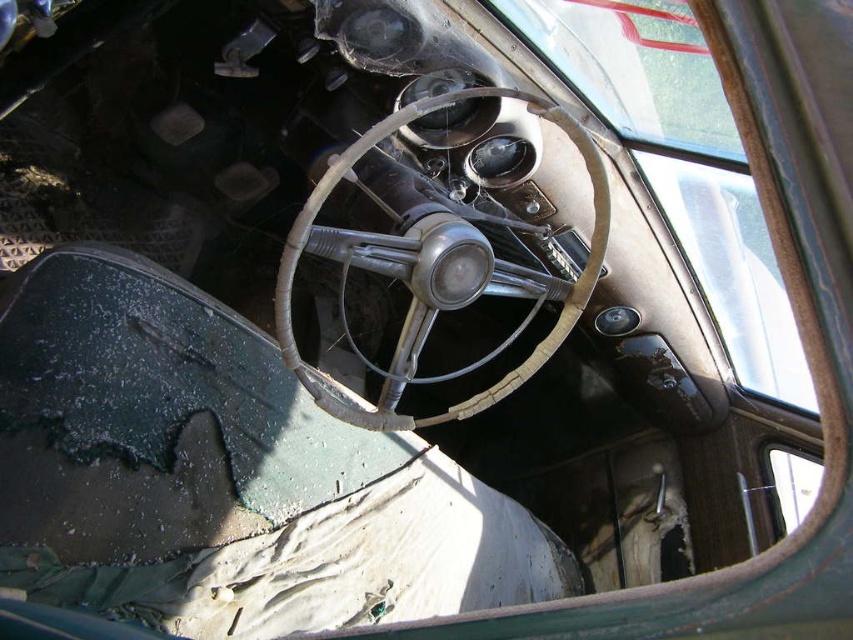
Question: Does transparent glass window at upper center have a greater width compared to leather/wooden steering wheel at center?

Choices:
 (A) yes
 (B) no

Answer: (A)

Question: Which point appears farthest from the camera in this image?

Choices:
 (A) (604, 188)
 (B) (633, 13)

Answer: (B)

Question: Is transparent glass window at upper center closer to the viewer compared to leather/wooden steering wheel at center?

Choices:
 (A) yes
 (B) no

Answer: (B)

Question: Is transparent glass window at upper center closer to camera compared to leather/wooden steering wheel at center?

Choices:
 (A) no
 (B) yes

Answer: (A)